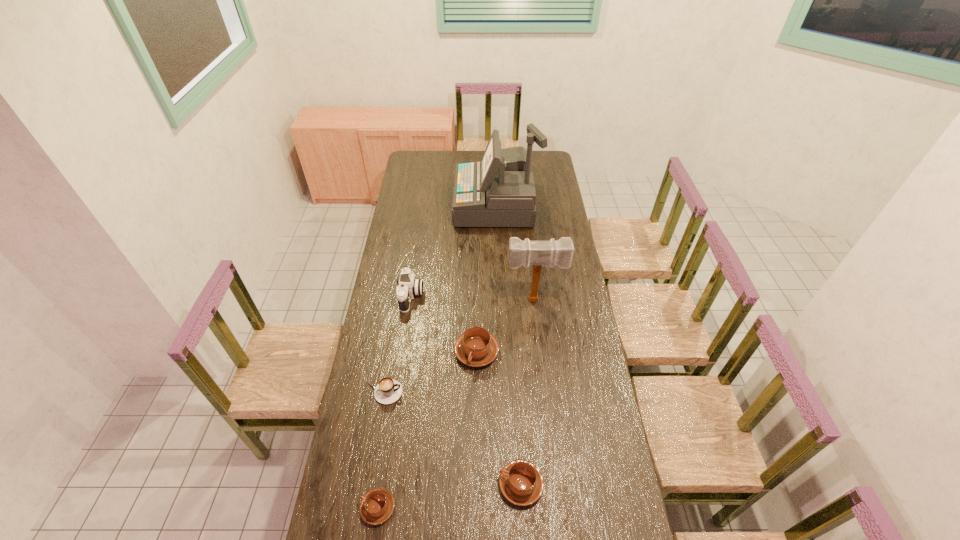
What are the coordinates of `the third nearest cappuccino` in the screenshot? It's located at (388, 390).

Image resolution: width=960 pixels, height=540 pixels. I want to click on the third nearest object, so click(388, 390).

In order to click on the smallest brown cappuccino in this screenshot , I will do `click(377, 505)`.

Find the location of a particular element. This screenshot has width=960, height=540. vacant position located on the customer-facing side of the cash register is located at coordinates (404, 205).

Find the location of a particular element. This screenshot has width=960, height=540. vacant space located 0.210m on the customer-facing side of the cash register is located at coordinates (417, 205).

The height and width of the screenshot is (540, 960). In order to click on free space located 0.130m on the customer-facing side of the cash register in this screenshot , I will do `click(431, 205)`.

Where is `vacant space situated on the back of the sixth shortest object`? The height and width of the screenshot is (540, 960). vacant space situated on the back of the sixth shortest object is located at coordinates (528, 243).

The height and width of the screenshot is (540, 960). In order to click on vacant position located 0.210m on the right of the black camera in this screenshot , I will do `click(469, 296)`.

I want to click on vacant area located 0.240m on the side of the farthest brown cappuccino with the handle, so click(476, 429).

This screenshot has width=960, height=540. I want to click on vacant region located on the side of the third shortest object with the handle, so click(434, 484).